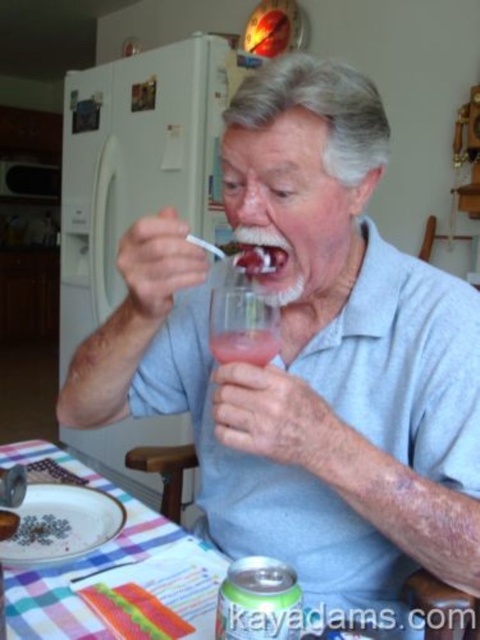
Question: Is translucent glass at lower center to the left of smooth red jelly at mouth from the viewer's perspective?

Choices:
 (A) no
 (B) yes

Answer: (A)

Question: Does green metallic can at lower center appear on the right side of smooth red jelly at mouth?

Choices:
 (A) no
 (B) yes

Answer: (B)

Question: Which object appears farthest from the camera in this image?

Choices:
 (A) green metallic can at lower center
 (B) translucent glass at lower center

Answer: (B)

Question: Among these points, which one is farthest from the camera?

Choices:
 (A) coord(277,252)
 (B) coord(245,358)

Answer: (A)

Question: Is green metallic can at lower center closer to camera compared to smooth red jelly at mouth?

Choices:
 (A) yes
 (B) no

Answer: (A)

Question: Which object is farther from the camera taking this photo?

Choices:
 (A) translucent glass at lower center
 (B) green metallic can at lower center

Answer: (A)